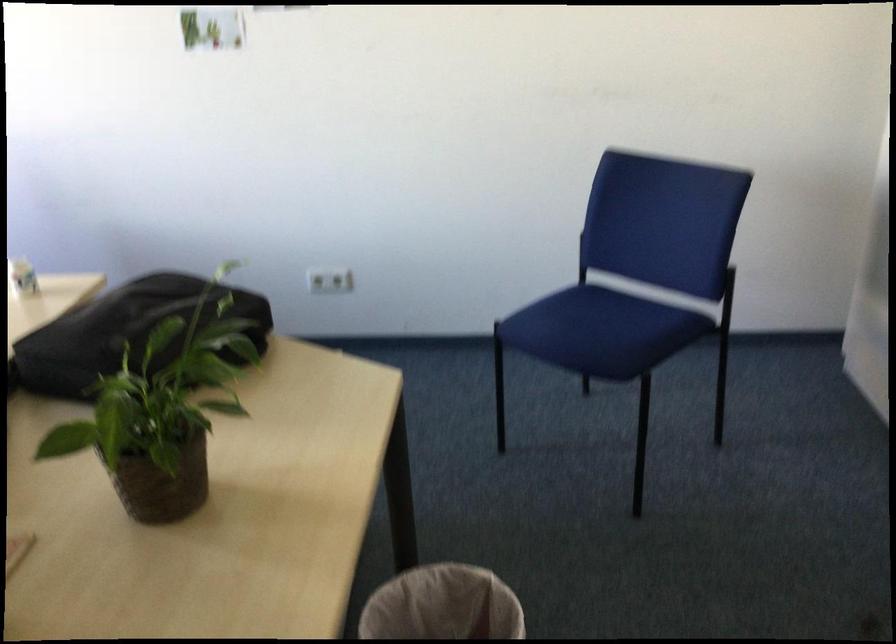
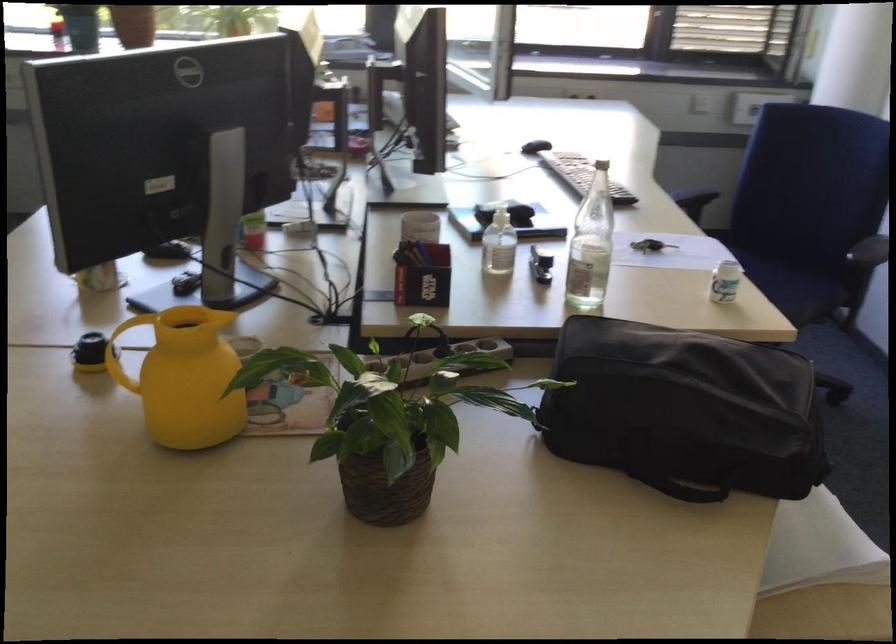
From the picture: How did the camera likely rotate?

The rotation direction of the camera is left-down.